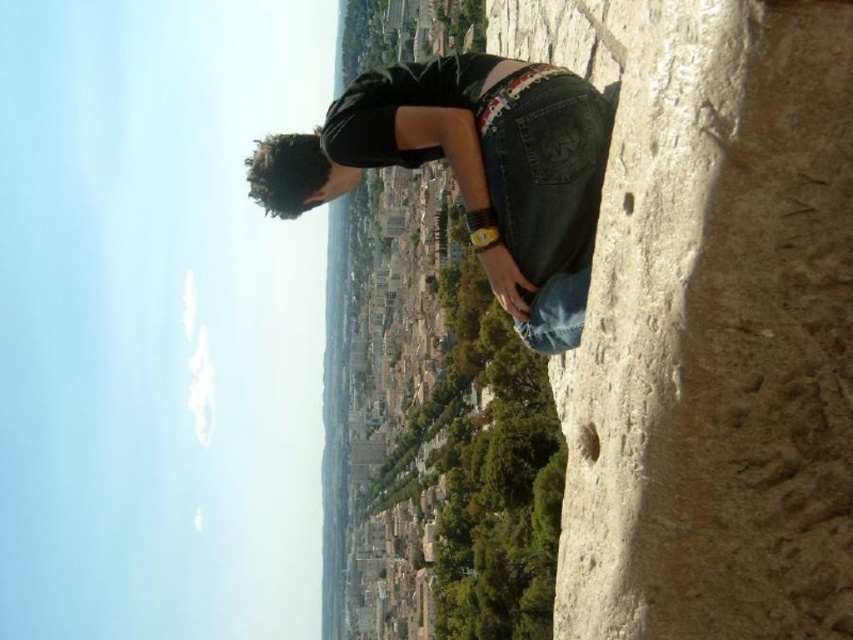
You are standing at the edge of the rough stone cliff at right. What coordinates mark its exact location?

The rough stone cliff at right is located at coordinates point (708, 321).

You are standing at the edge of the scene and want to move towards the rough stone cliff at right. Which direction should you move relative to the jeans at center?

You should move to the right of the jeans at center because the rough stone cliff at right is located to the right of the jeans at center.